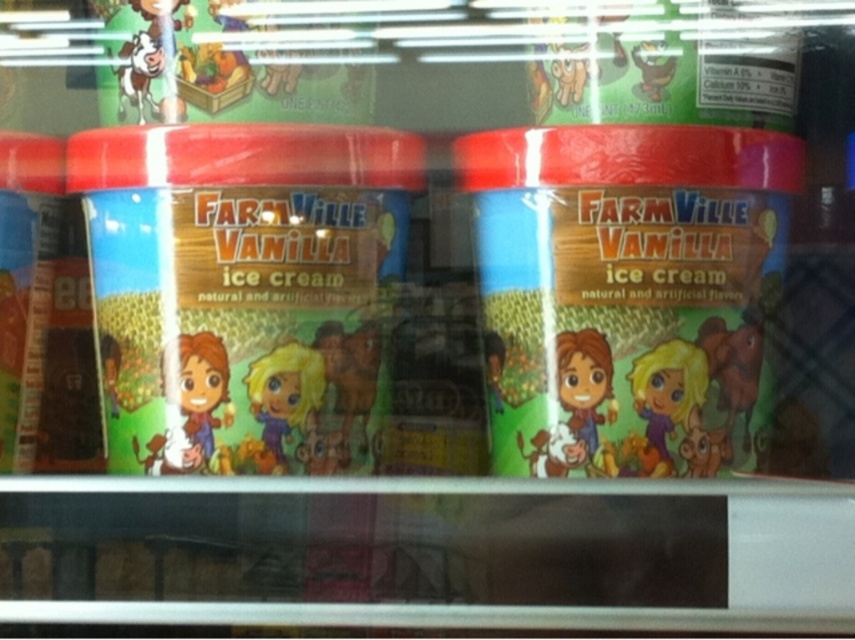
Question: Is matte plastic ice cream container at center closer to the viewer compared to matte plastic farmville vanilla ice cream at center?

Choices:
 (A) no
 (B) yes

Answer: (A)

Question: Which is nearer to the matte plastic ice cream container at center?

Choices:
 (A) matte plastic tub at left
 (B) matte plastic farmville vanilla ice cream at center

Answer: (A)

Question: Which point is closer to the camera taking this photo?

Choices:
 (A) (6, 244)
 (B) (715, 429)

Answer: (B)

Question: Is matte plastic ice cream container at center in front of matte plastic farmville vanilla ice cream at center?

Choices:
 (A) yes
 (B) no

Answer: (B)

Question: Which object is the closest to the matte plastic farmville vanilla ice cream at center?

Choices:
 (A) matte plastic ice cream container at center
 (B) matte plastic tub at left

Answer: (A)

Question: Is matte plastic ice cream container at center positioned behind matte plastic farmville vanilla ice cream at center?

Choices:
 (A) yes
 (B) no

Answer: (A)